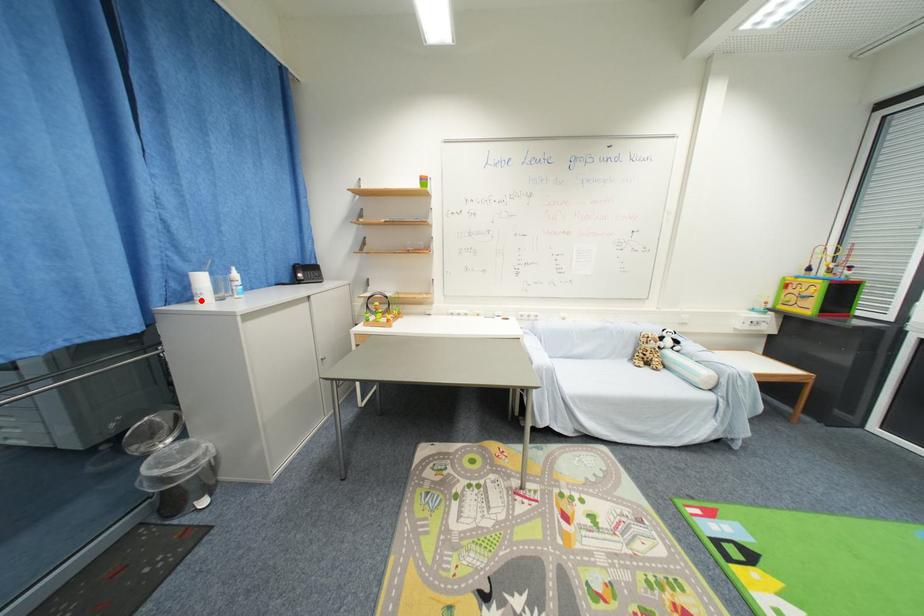
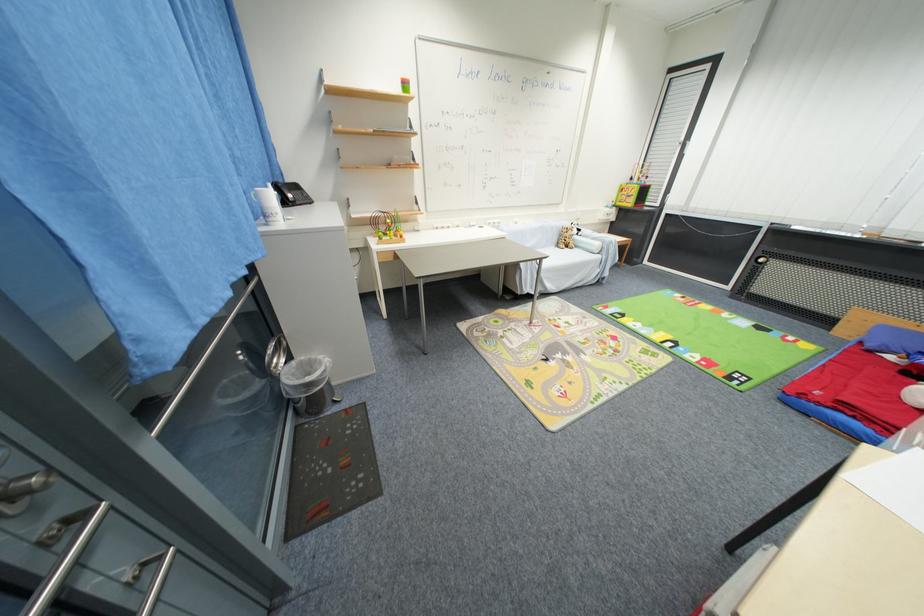
Find the pixel in the second image that matches the highlighted location in the first image.

(275, 222)